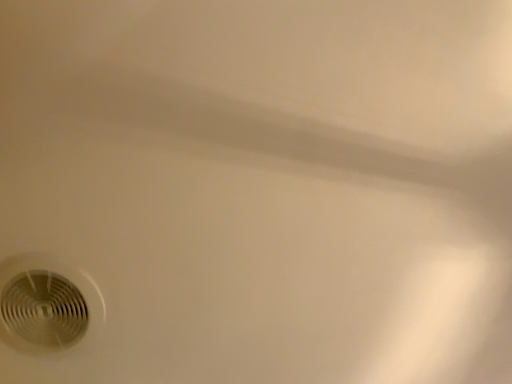
What is the approximate height of white plastic mechanical fan at lower left?

0.44 inches.

Image resolution: width=512 pixels, height=384 pixels. In order to click on white plastic mechanical fan at lower left in this screenshot , I will do `click(47, 304)`.

What do you see at coordinates (47, 304) in the screenshot? I see `white plastic mechanical fan at lower left` at bounding box center [47, 304].

Looking at this image, in order to face white plastic mechanical fan at lower left, should I rotate leftwards or rightwards?

A 25.868 degree turn to the left will do.

You are a GUI agent. You are given a task and a screenshot of the screen. Output one action in this format:
    pyautogui.click(x=<x>, y=<y>)
    Task: Click on the white plastic mechanical fan at lower left
    The width and height of the screenshot is (512, 384).
    Given the screenshot: What is the action you would take?
    pyautogui.click(x=47, y=304)